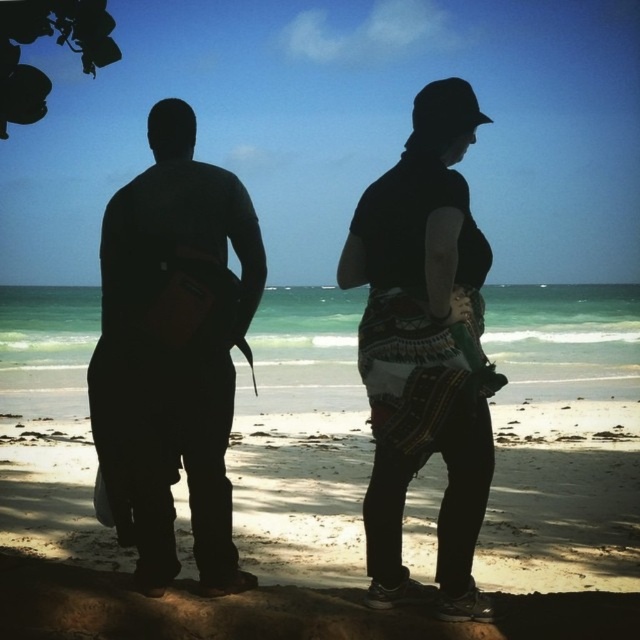
You are a photographer trying to capture the scene. You want to ensure both the black matte bag at left and the black textured fabric skirt at center are visible in your photo. Which object should you position closer to the left edge of the frame to include both?

You should position the black matte bag at left closer to the left edge of the frame since it is already to the left of the black textured fabric skirt at center, ensuring both are visible.

You are packing for a beach trip and have both a black matte bag at left and a black textured fabric skirt at center. Which item can you fit into a small compartment in your luggage?

The black matte bag at left is smaller than the black textured fabric skirt at center, so it can fit into a small compartment in your luggage.

You are planning to set up a small tent on the beach. Given the image, which area between the silhouette fabric at center and the smooth sand at center would be more suitable for placing the tent?

The smooth sand at center is more suitable for placing the tent because the silhouette fabric at center occupies less space, meaning the smooth sand at center has a larger area available for setup.